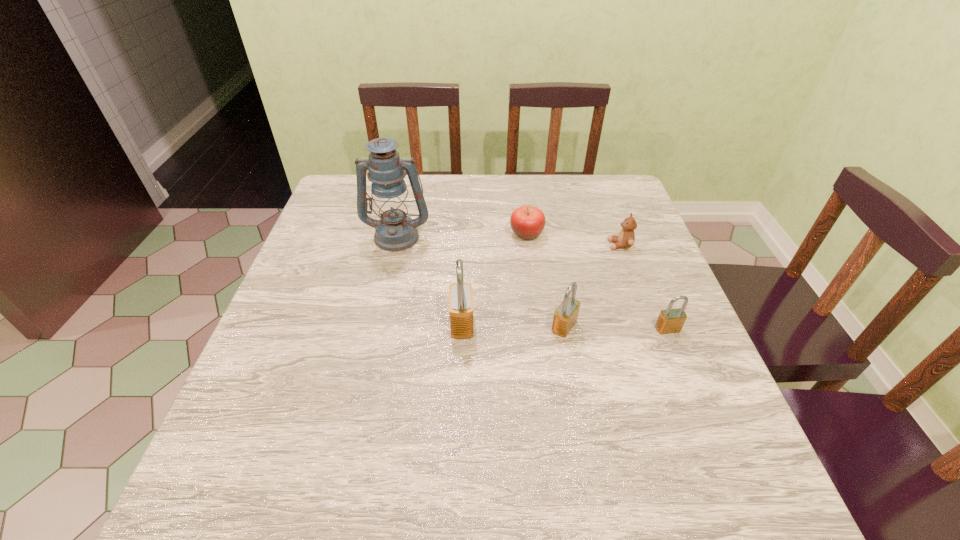
Where is `vacant region between the tallest object and the fourth shortest object`? The width and height of the screenshot is (960, 540). vacant region between the tallest object and the fourth shortest object is located at coordinates (481, 281).

Find the location of a particular element. Image resolution: width=960 pixels, height=540 pixels. free area in between the second shortest padlock and the tallest object is located at coordinates (481, 281).

Find the location of a particular element. vacant space in between the fourth shortest object and the apple is located at coordinates (545, 280).

Locate an element on the screen. The height and width of the screenshot is (540, 960). vacant point located between the second tallest padlock and the apple is located at coordinates [545, 280].

This screenshot has height=540, width=960. I want to click on empty location between the second padlock from right to left and the shortest padlock, so click(x=616, y=328).

Identify the location of free spot between the lantern and the second object from left to right. (429, 280).

This screenshot has height=540, width=960. In order to click on object that stands as the fourth closest to the second tallest padlock in this screenshot , I will do [x=527, y=222].

Identify which object is the fourth nearest to the apple. Please provide its 2D coordinates. Your answer should be formatted as a tuple, i.e. [(x, y)], where the tuple contains the x and y coordinates of a point satisfying the conditions above.

[(565, 316)]

Where is `padlock that is the second nearest to the rightmost padlock`? The height and width of the screenshot is (540, 960). padlock that is the second nearest to the rightmost padlock is located at coordinates (460, 294).

Where is `padlock that is the second closest to the second shortest padlock`? padlock that is the second closest to the second shortest padlock is located at coordinates (671, 320).